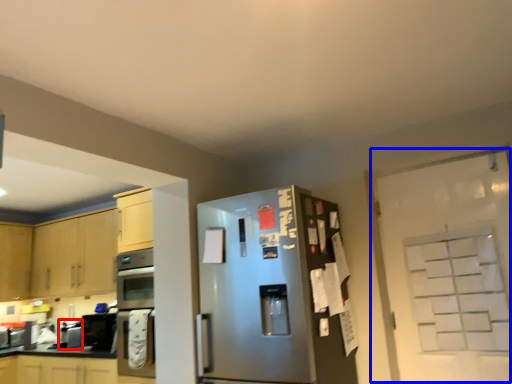
Question: Which object is further to the camera taking this photo, appliance (highlighted by a red box) or door (highlighted by a blue box)?

Choices:
 (A) appliance
 (B) door

Answer: (A)